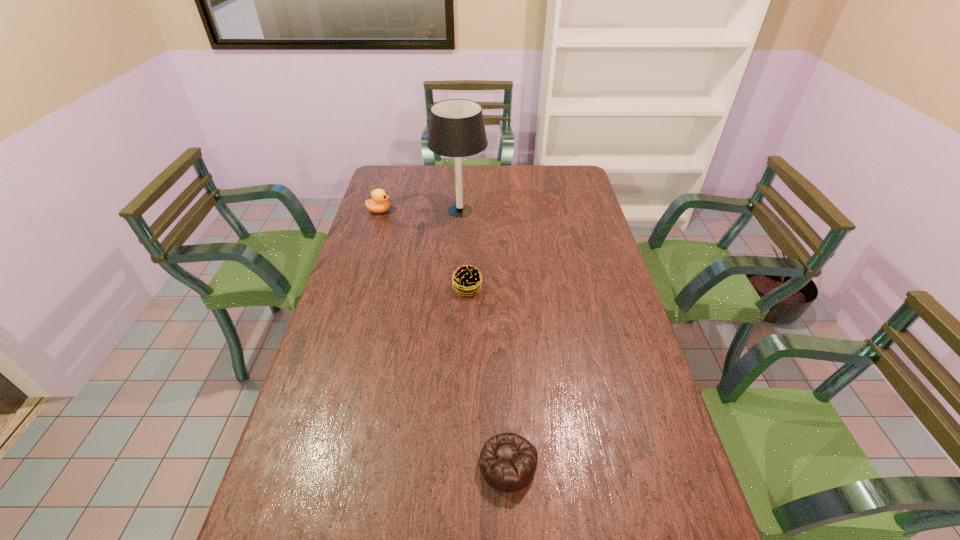
Find the location of `the tallest object`. the tallest object is located at coordinates (456, 129).

This screenshot has width=960, height=540. Identify the location of duckling. (378, 203).

Identify the location of the second tallest object. The width and height of the screenshot is (960, 540). (378, 203).

In order to click on the third tallest object in this screenshot , I will do `click(466, 279)`.

The image size is (960, 540). Find the location of `patty`. patty is located at coordinates (466, 279).

Locate an element on the screen. Image resolution: width=960 pixels, height=540 pixels. beanbag is located at coordinates (508, 461).

This screenshot has width=960, height=540. In order to click on the nearest object in this screenshot , I will do `click(508, 461)`.

Locate an element on the screen. The height and width of the screenshot is (540, 960). free space located 0.120m on the back of the tallest object is located at coordinates (462, 182).

Locate an element on the screen. The image size is (960, 540). vacant space positioned on the face of the second tallest object is located at coordinates (458, 211).

At what (x,y) coordinates should I click in order to perform the action: click on free spot located on the front of the second nearest object. Please return your answer as a coordinate pair (x, y). This screenshot has height=540, width=960. Looking at the image, I should click on (466, 342).